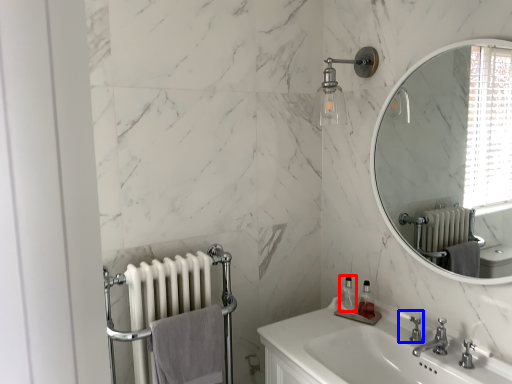
Question: Which point is further to the camera, soap dispenser (highlighted by a red box) or plumbing fixture (highlighted by a blue box)?

Choices:
 (A) soap dispenser
 (B) plumbing fixture

Answer: (A)